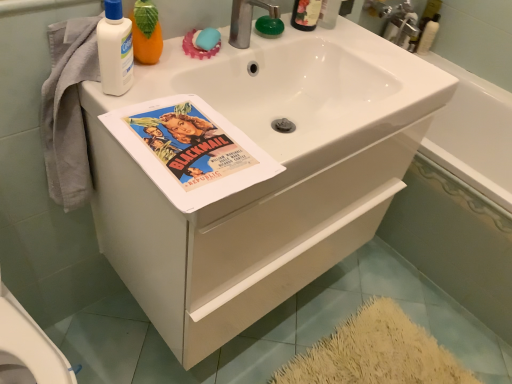
At what (x,y) coordinates should I click in order to perform the action: click on vacant space underneath matte paper poster at center (from a real-world perspective). Please return your answer as a coordinate pair (x, y). Looking at the image, I should click on (189, 146).